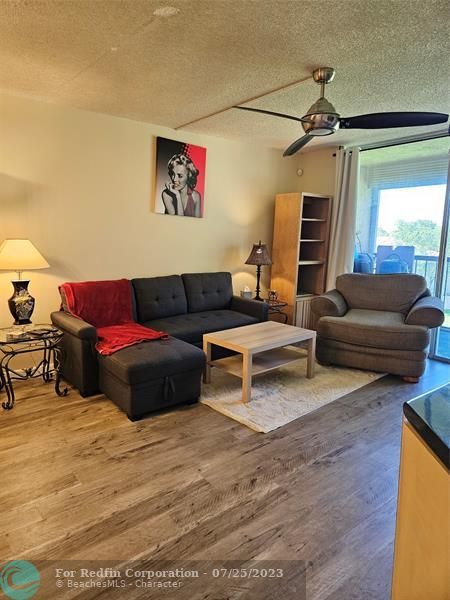
Locate an element on the screen. This screenshot has width=450, height=600. ceiling is located at coordinates (205, 87).